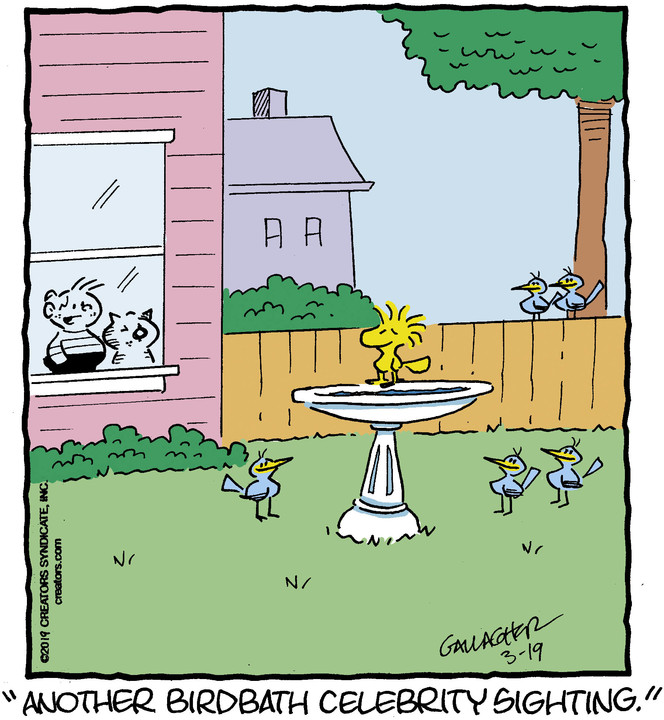
This screenshot has height=720, width=664. I want to click on window frame, so click(121, 250).